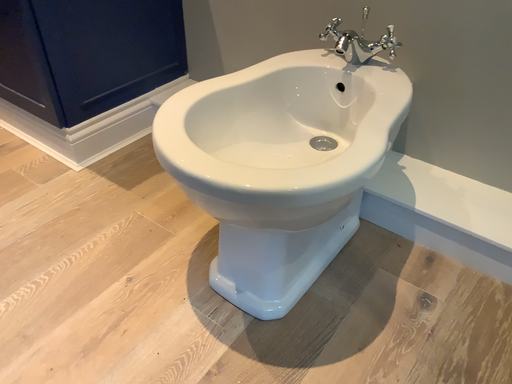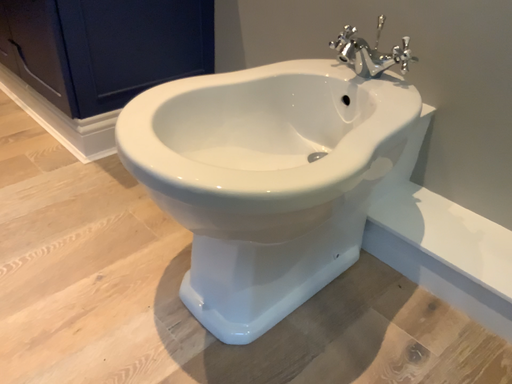
Question: Which way did the camera rotate in the video?

Choices:
 (A) rotated left
 (B) rotated right

Answer: (A)